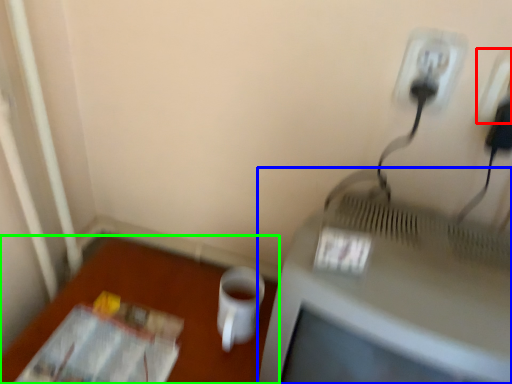
Question: Which object is positioned closest to electric outlet (highlighted by a red box)? Select from television (highlighted by a blue box) and table (highlighted by a green box).

Choices:
 (A) television
 (B) table

Answer: (A)